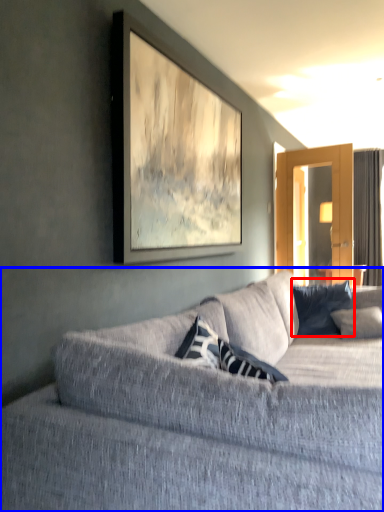
Question: Which of the following is the closest to the observer, pillow (highlighted by a red box) or studio couch (highlighted by a blue box)?

Choices:
 (A) pillow
 (B) studio couch

Answer: (B)